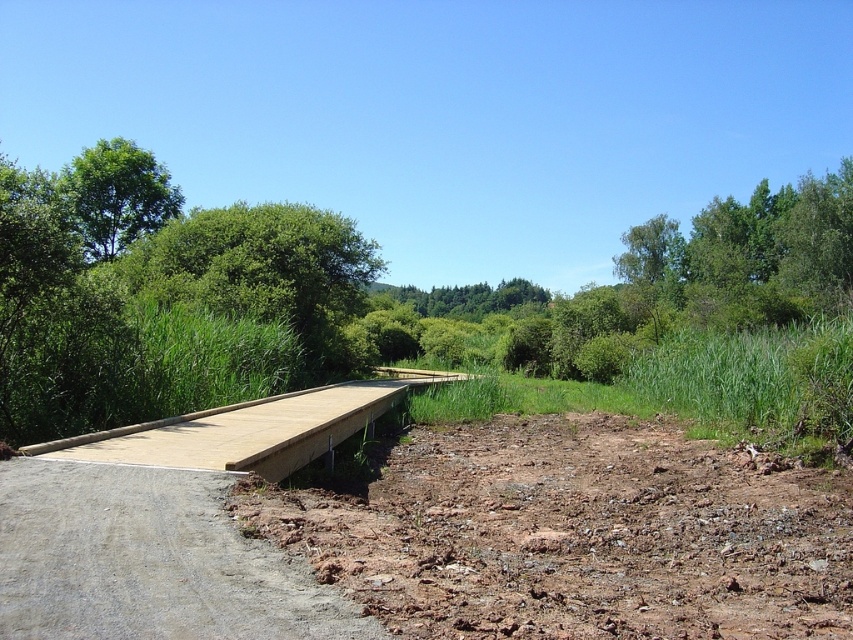
Question: Which of the following is the farthest from the observer?

Choices:
 (A) (306, 582)
 (B) (143, 460)

Answer: (B)

Question: Can you confirm if smooth concrete path at lower left is wider than green leafy tree at upper left?

Choices:
 (A) no
 (B) yes

Answer: (A)

Question: Does smooth concrete path at lower left have a larger size compared to green leafy tree at upper left?

Choices:
 (A) yes
 (B) no

Answer: (B)

Question: Which point appears closest to the camera in this image?

Choices:
 (A) (310, 412)
 (B) (828, 544)
 (C) (285, 570)
 (D) (109, 182)

Answer: (C)

Question: Which of the following is the farthest from the observer?

Choices:
 (A) (219, 458)
 (B) (109, 176)
 (C) (608, 484)
 (D) (213, 596)

Answer: (B)

Question: Can you confirm if smooth concrete path at lower left is wider than green leafy tree at upper left?

Choices:
 (A) no
 (B) yes

Answer: (A)